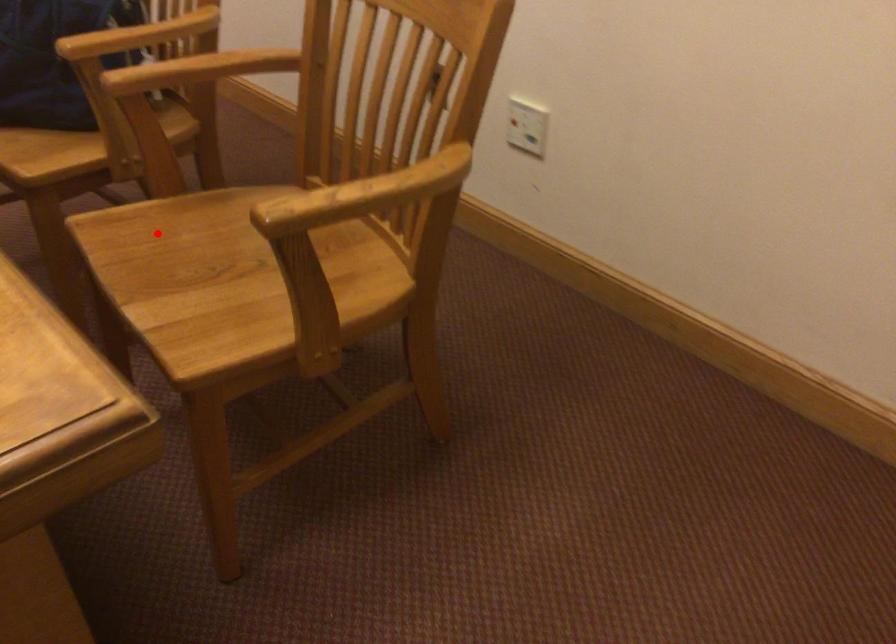
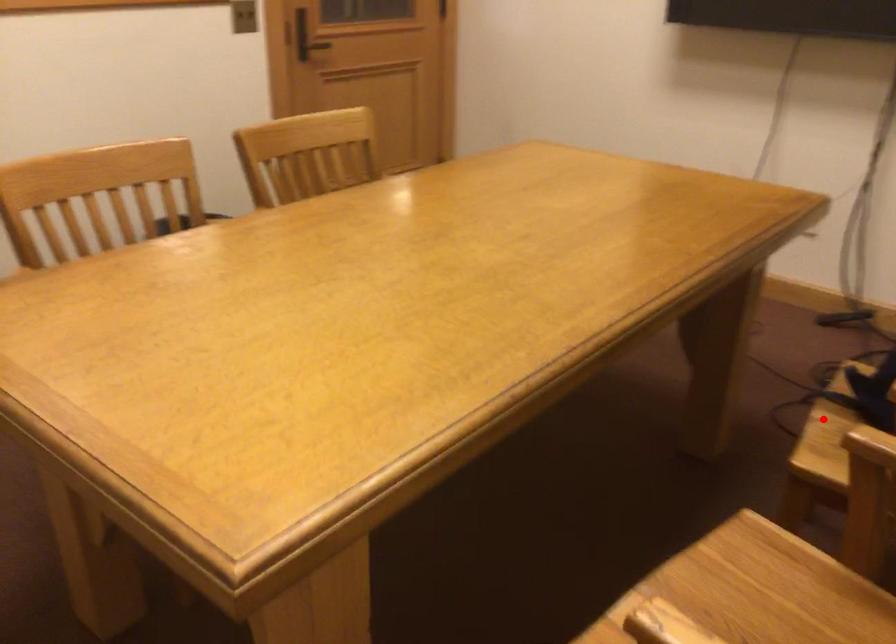
I am providing you with two images of the same scene from different viewpoints. A red point is marked on the first image and another point is marked on the second image. Does the point marked in image1 correspond to the same location as the one in image2?

No